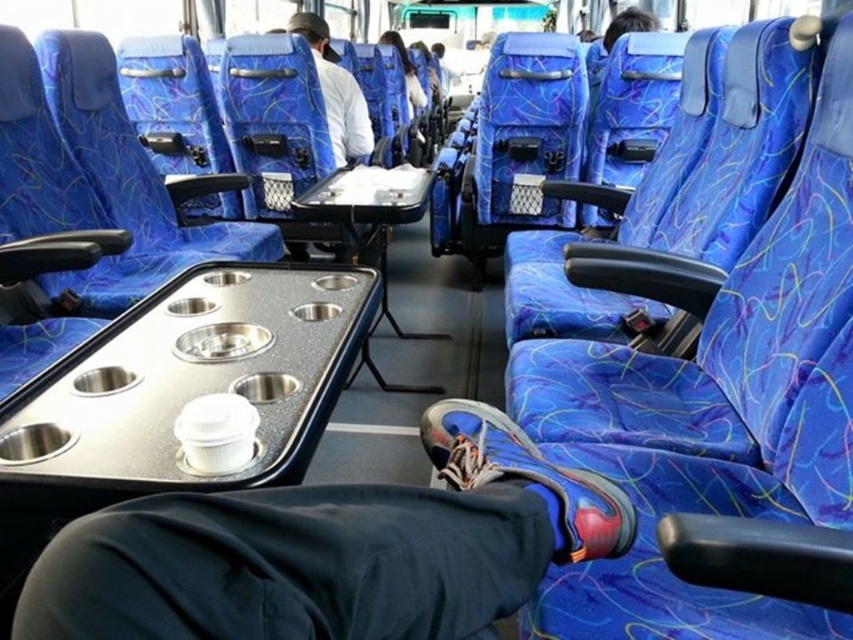
Question: Can you confirm if shiny plastic cup at center is positioned to the right of matte white shirt at center?

Choices:
 (A) no
 (B) yes

Answer: (B)

Question: Which point is farther to the camera?

Choices:
 (A) matte white shirt at center
 (B) blue synthetic shoe at lower center
 (C) shiny plastic cup at center
 (D) blue fabric seat at center

Answer: (D)

Question: Based on their relative distances, which object is nearer to the shiny plastic cup at center?

Choices:
 (A) matte white shirt at center
 (B) blue fabric seat at center
 (C) blue synthetic shoe at lower center

Answer: (C)

Question: Which object is the closest to the blue synthetic shoe at lower center?

Choices:
 (A) matte white shirt at center
 (B) shiny plastic cup at center
 (C) blue fabric seat at center

Answer: (B)

Question: Can you confirm if blue synthetic shoe at lower center is positioned to the right of matte white shirt at center?

Choices:
 (A) yes
 (B) no

Answer: (A)

Question: Does blue synthetic shoe at lower center have a larger size compared to matte white shirt at center?

Choices:
 (A) yes
 (B) no

Answer: (B)